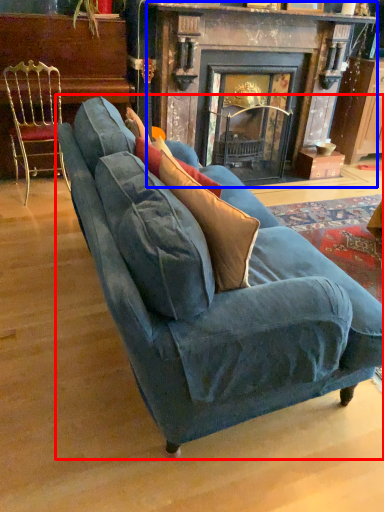
Question: Which object appears closest to the camera in this image, studio couch (highlighted by a red box) or fireplace (highlighted by a blue box)?

Choices:
 (A) studio couch
 (B) fireplace

Answer: (A)